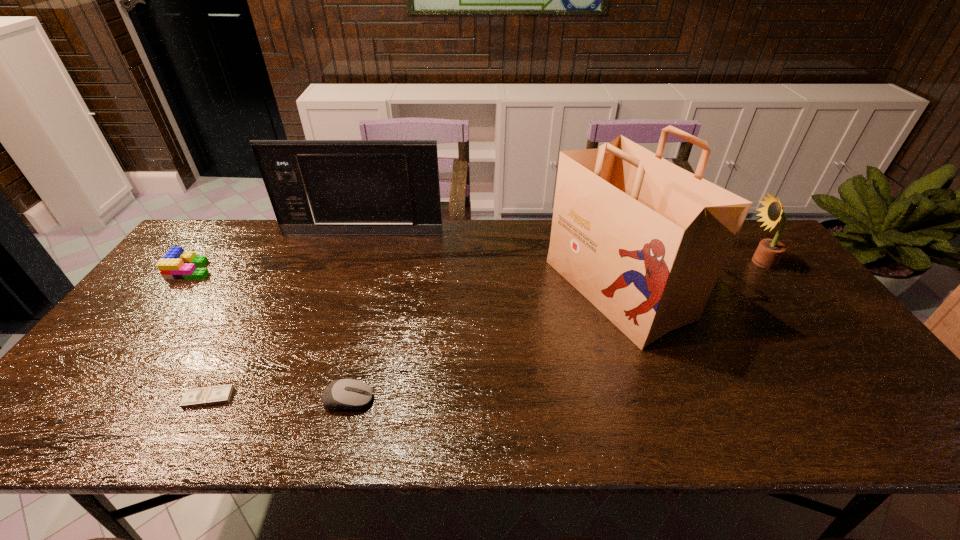
Find the location of a particular element. free space that is in between the computer equipment and the shortest object is located at coordinates (278, 399).

This screenshot has height=540, width=960. In order to click on unoccupied area between the leftmost object and the computer equipment in this screenshot , I will do `click(270, 335)`.

At what (x,y) coordinates should I click in order to perform the action: click on vacant area between the fourth tallest object and the money. Please return your answer as a coordinate pair (x, y). Image resolution: width=960 pixels, height=540 pixels. Looking at the image, I should click on (201, 334).

This screenshot has height=540, width=960. In order to click on empty space between the second shortest object and the second object from right to left in this screenshot , I will do `click(483, 345)`.

Identify the location of free space between the Lego and the shortest object. (201, 334).

At what (x,y) coordinates should I click in order to perform the action: click on free space between the money and the grocery bag. Please return your answer as a coordinate pair (x, y). This screenshot has width=960, height=540. Looking at the image, I should click on (413, 344).

Locate an element on the screen. The image size is (960, 540). object that is the closest to the Lego is located at coordinates (316, 187).

Identify which object is the third closest to the sunflower. Please provide its 2D coordinates. Your answer should be formatted as a tuple, i.e. [(x, y)], where the tuple contains the x and y coordinates of a point satisfying the conditions above.

[(344, 394)]

Find the location of `free location that satisfies the following two spatial constraints: 1. on the face of the sunflower; 2. on the front side of the Lego`. free location that satisfies the following two spatial constraints: 1. on the face of the sunflower; 2. on the front side of the Lego is located at coordinates (765, 269).